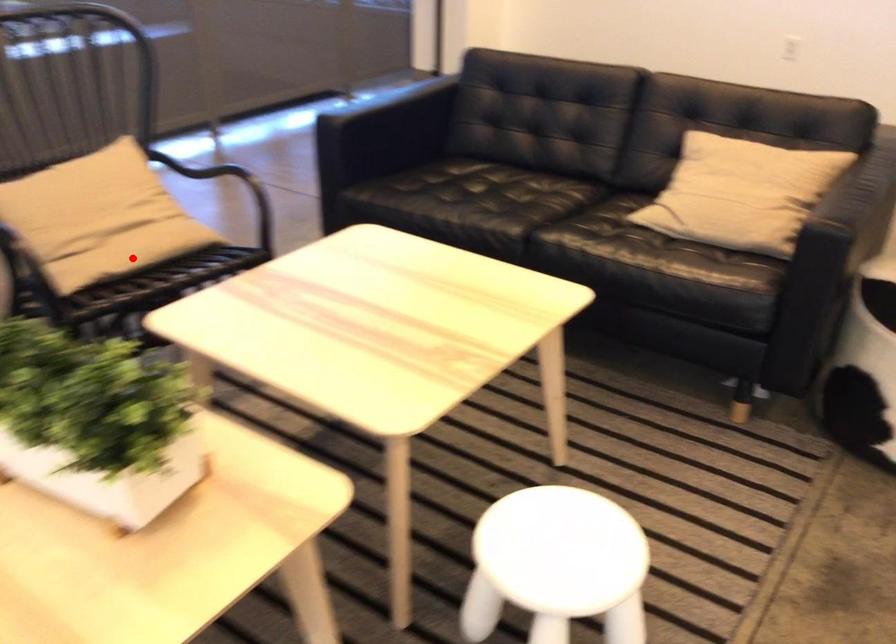
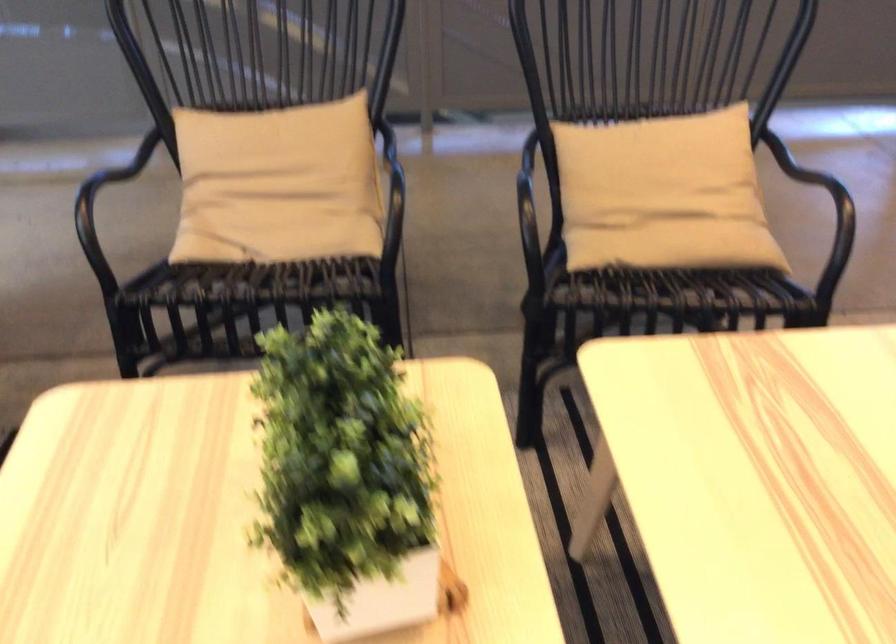
Question: I am providing you with two images of the same scene from different viewpoints. Image1 has a red point marked. In image2, the corresponding 3D location appears at what relative position? Reply with the corresponding letter.

Choices:
 (A) Closer
 (B) Farther

Answer: (A)